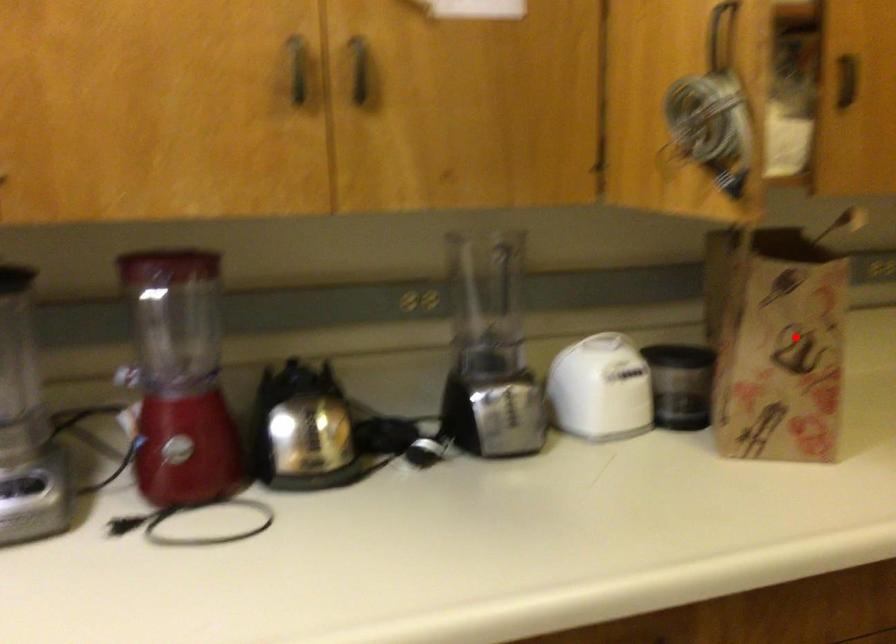
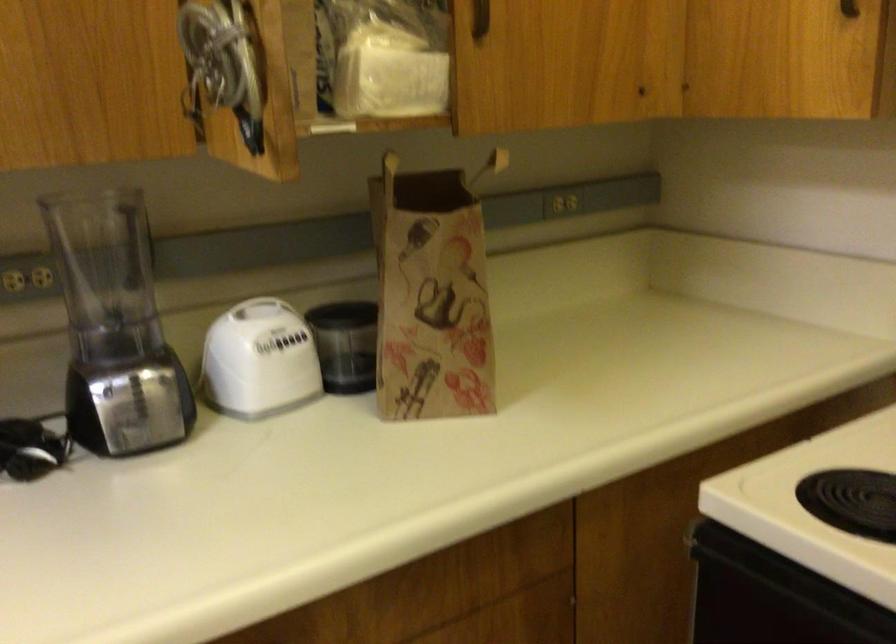
Where in the second image is the point corresponding to the highlighted location from the first image?

(431, 295)